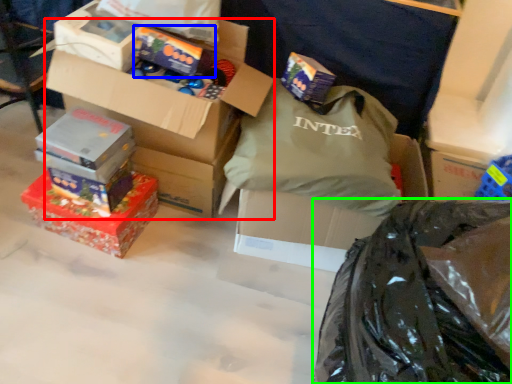
Question: Which object is positioned farthest from box (highlighted by a red box)? Select from box (highlighted by a blue box) and plastic bag (highlighted by a green box).

Choices:
 (A) box
 (B) plastic bag

Answer: (B)